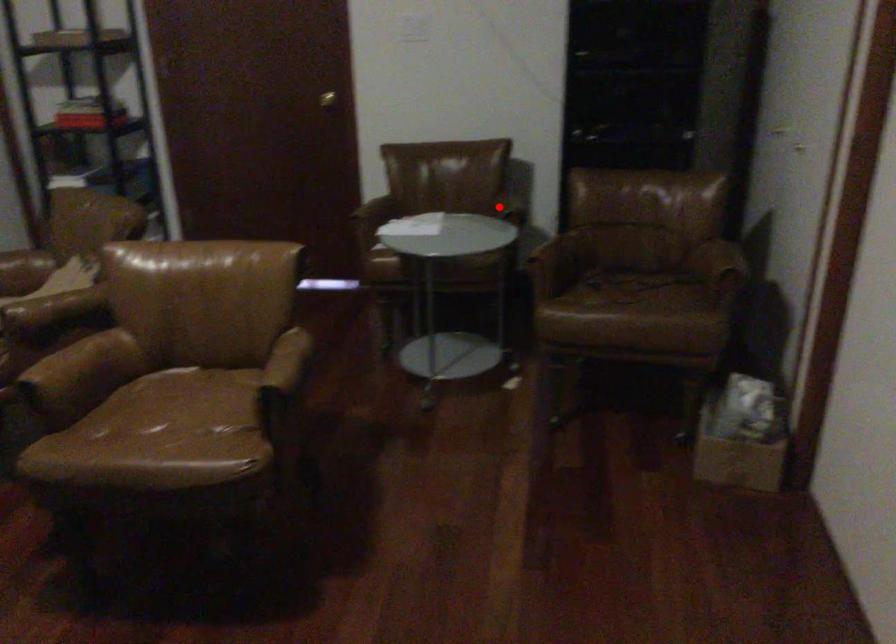
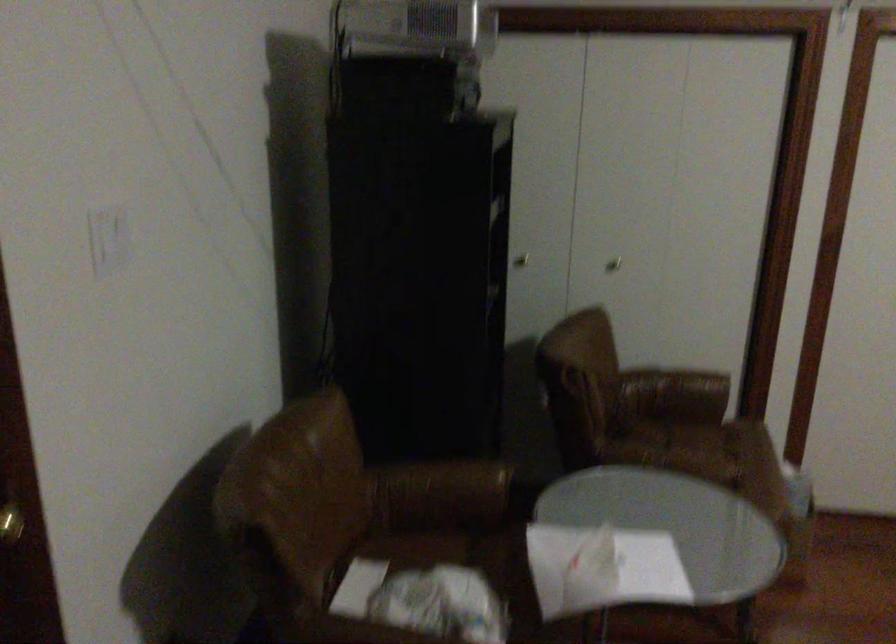
Where in the second image is the point corresponding to the highlighted location from the first image?

(442, 488)